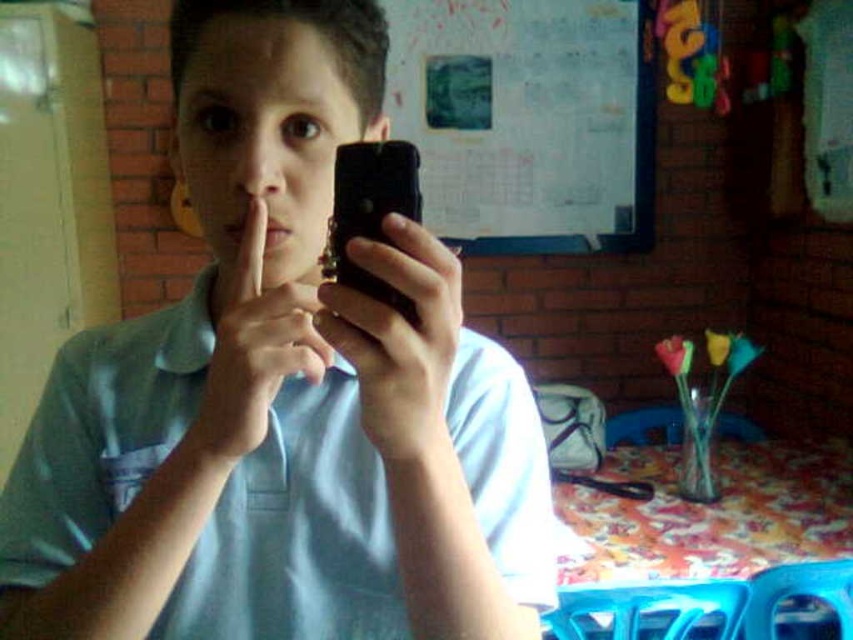
Question: Does white paper at upper center have a greater width compared to black matte smartphone at center?

Choices:
 (A) yes
 (B) no

Answer: (A)

Question: Considering the real-world distances, which object is closest to the matte skin at center?

Choices:
 (A) matte black phone at center
 (B) black matte smartphone at center
 (C) matte blue shirt at center

Answer: (A)

Question: Does matte blue shirt at center come behind white paper at upper center?

Choices:
 (A) no
 (B) yes

Answer: (A)

Question: Can you confirm if matte blue shirt at center is smaller than matte black phone at center?

Choices:
 (A) no
 (B) yes

Answer: (A)

Question: Which object is farther from the camera taking this photo?

Choices:
 (A) matte skin at center
 (B) matte blue shirt at center
 (C) white paper at upper center
 (D) black matte smartphone at center

Answer: (C)

Question: Which is nearer to the black matte smartphone at center?

Choices:
 (A) matte blue shirt at center
 (B) matte black phone at center
 (C) matte skin at center

Answer: (B)